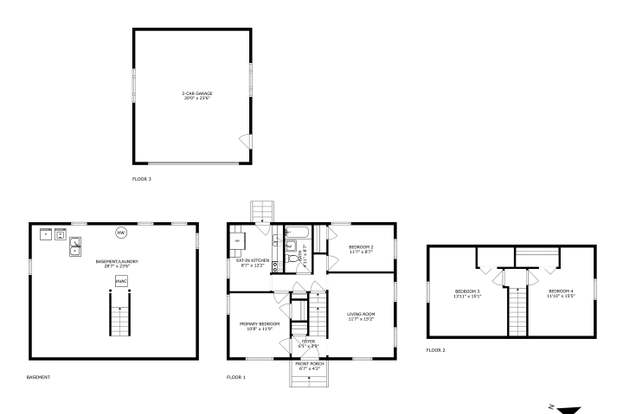
Find the location of a particular element. floor 1 is located at coordinates (258, 337).